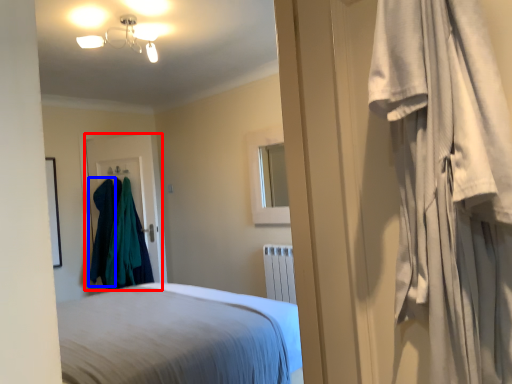
Question: Among these objects, which one is farthest to the camera, door (highlighted by a red box) or clothing (highlighted by a blue box)?

Choices:
 (A) door
 (B) clothing

Answer: (A)